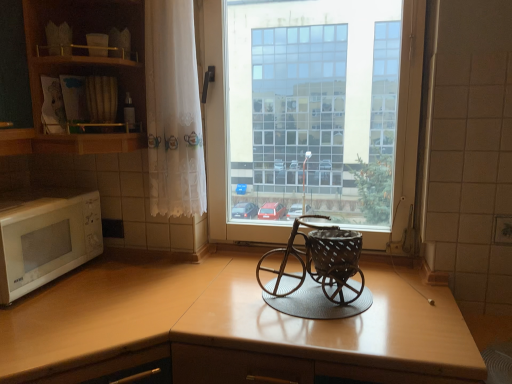
Find the location of `unoccupied region to the right of white matte microwave at left`. unoccupied region to the right of white matte microwave at left is located at coordinates pyautogui.click(x=119, y=284).